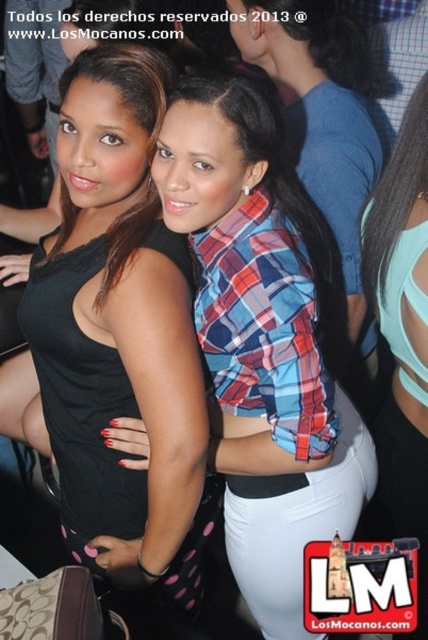
You are a photographer at the event and want to ensure the black matte tank top at center and plaid fabric shirt at center are both visible in the photo. Based on their positions, which one is more likely to be fully visible?

The black matte tank top at center is positioned over the plaid fabric shirt at center, so the plaid fabric shirt at center is more likely to be fully visible since it is underneath.

You are standing at the point marked as point [187,502] and want to take a photo of the two women in the scene. If your camera has a focal length of 50mm and you want to capture both women in the frame without moving, what is the minimum distance you should be from them?

The point marked as point [187,502] is 1.15 meters away from the viewer. To capture both women in the frame without moving, the minimum distance you should be from them is 1.15 meters.

You are a photographer at the event and want to focus on the black matte tank top at center and the plaid fabric shirt at center. Which one is closer to you?

The black matte tank top at center is closer to you because it is further to the viewer than the plaid fabric shirt at center.